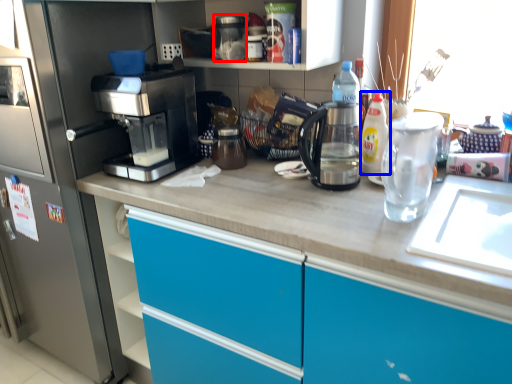
Question: Among these objects, which one is nearest to the camera, appliance (highlighted by a red box) or bottle (highlighted by a blue box)?

Choices:
 (A) appliance
 (B) bottle

Answer: (B)